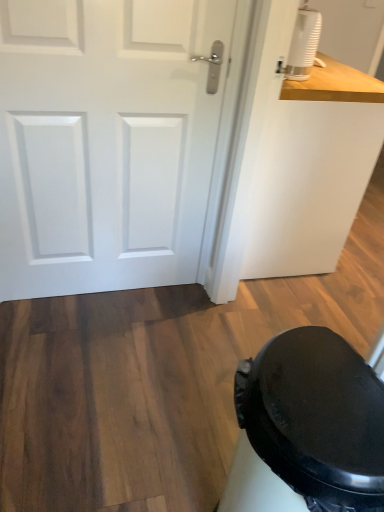
The height and width of the screenshot is (512, 384). What are the coordinates of `black matte potty at lower right` in the screenshot? It's located at (316, 418).

What do you see at coordinates (304, 45) in the screenshot?
I see `white matte humidifier at upper right` at bounding box center [304, 45].

The image size is (384, 512). In order to click on black matte potty at lower right in this screenshot , I will do `click(316, 418)`.

From a real-world perspective, is black matte potty at lower right above or below white matte humidifier at upper right?

black matte potty at lower right is below white matte humidifier at upper right.

What's the angular difference between black matte potty at lower right and white matte humidifier at upper right's facing directions?

The facing directions of black matte potty at lower right and white matte humidifier at upper right are 176 degrees apart.

Identify the location of potty on the left of the white matte humidifier at upper right. (316, 418).

How distant is black matte potty at lower right from white matte humidifier at upper right?

A distance of 4.19 feet exists between black matte potty at lower right and white matte humidifier at upper right.

Between white matte humidifier at upper right and white matte door at upper left, which one appears on the right side from the viewer's perspective?

white matte humidifier at upper right is more to the right.

How much distance is there between white matte humidifier at upper right and white matte door at upper left?

They are 29.35 inches apart.

Which of these two, white matte humidifier at upper right or white matte door at upper left, is bigger?

Bigger between the two is white matte door at upper left.

Locate an element on the screen. appliance on the right side of white matte door at upper left is located at coordinates (304, 45).

Is there a large distance between white matte door at upper left and white matte humidifier at upper right?

No, white matte door at upper left is not far from white matte humidifier at upper right.

Looking at this image, from the image's perspective, is white matte door at upper left above or below white matte humidifier at upper right?

From the image's perspective, white matte door at upper left appears below white matte humidifier at upper right.

Is white matte humidifier at upper right surrounded by white matte door at upper left?

No, white matte humidifier at upper right is not a part of white matte door at upper left.

Which object is positioned more to the right, white matte door at upper left or white matte humidifier at upper right?

white matte humidifier at upper right.

Is white matte humidifier at upper right at the left side of black matte potty at lower right?

No, white matte humidifier at upper right is not to the left of black matte potty at lower right.

Are white matte humidifier at upper right and black matte potty at lower right far apart?

Yes, white matte humidifier at upper right and black matte potty at lower right are located far from each other.

Is white matte humidifier at upper right situated inside black matte potty at lower right or outside?

white matte humidifier at upper right is outside black matte potty at lower right.

Does point (312, 33) come behind point (324, 446)?

Yes, it is behind point (324, 446).

Considering the sizes of objects black matte potty at lower right and white matte door at upper left in the image provided, who is wider, black matte potty at lower right or white matte door at upper left?

Wider between the two is black matte potty at lower right.

Can you confirm if black matte potty at lower right is positioned to the left of white matte door at upper left?

No.

Which of these two, white matte door at upper left or black matte potty at lower right, is wider?

Wider between the two is black matte potty at lower right.

Looking at this image, from a real-world perspective, is white matte door at upper left on top of black matte potty at lower right?

Yes.

Is white matte door at upper left not near black matte potty at lower right?

Yes.

Where is `door located above the black matte potty at lower right (from a real-world perspective)`? door located above the black matte potty at lower right (from a real-world perspective) is located at coordinates (106, 141).

Find the location of a particular element. The height and width of the screenshot is (512, 384). potty below the white matte humidifier at upper right (from the image's perspective) is located at coordinates (316, 418).

Find the location of a particular element. The width and height of the screenshot is (384, 512). appliance on the right of white matte door at upper left is located at coordinates (304, 45).

Estimate the real-world distances between objects in this image. Which object is further from white matte door at upper left, white matte humidifier at upper right or black matte potty at lower right?

Among the two, black matte potty at lower right is located further to white matte door at upper left.

Which object lies further to the anchor point white matte humidifier at upper right, black matte potty at lower right or white matte door at upper left?

black matte potty at lower right is further to white matte humidifier at upper right.

Based on their spatial positions, is white matte door at upper left or black matte potty at lower right further from white matte humidifier at upper right?

Based on the image, black matte potty at lower right appears to be further to white matte humidifier at upper right.

From the image, which object appears to be nearer to black matte potty at lower right, white matte humidifier at upper right or white matte door at upper left?

white matte door at upper left lies closer to black matte potty at lower right than the other object.

Based on their spatial positions, is white matte door at upper left or white matte humidifier at upper right further from black matte potty at lower right?

white matte humidifier at upper right is further to black matte potty at lower right.

Estimate the real-world distances between objects in this image. Which object is closer to white matte door at upper left, black matte potty at lower right or white matte humidifier at upper right?

white matte humidifier at upper right is closer to white matte door at upper left.

Image resolution: width=384 pixels, height=512 pixels. Find the location of `door between white matte humidifier at upper right and black matte potty at lower right vertically`. door between white matte humidifier at upper right and black matte potty at lower right vertically is located at coordinates (106, 141).